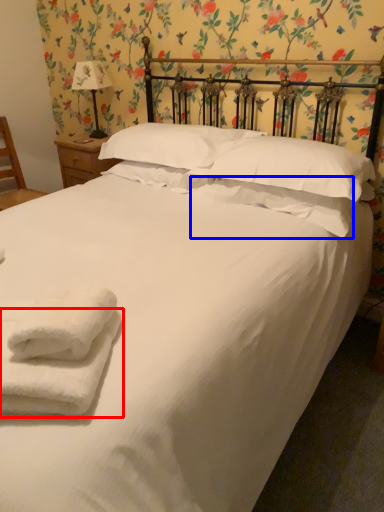
Question: Which point is further to the camera, towel (highlighted by a red box) or pillow (highlighted by a blue box)?

Choices:
 (A) towel
 (B) pillow

Answer: (B)